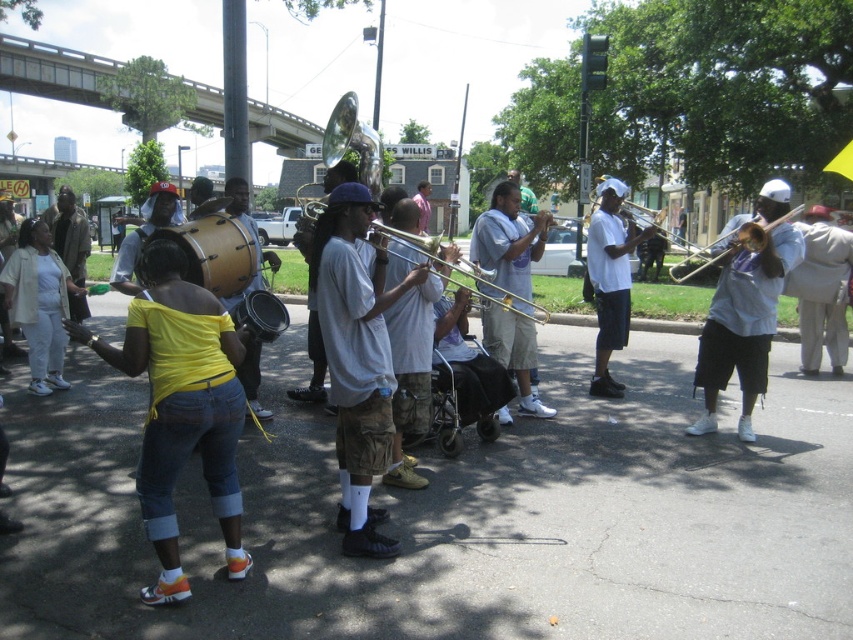
Is yellow fabric shirt at center further to camera compared to matte black jacket at left?

No, it is not.

Can you confirm if yellow fabric shirt at center is bigger than matte black jacket at left?

Actually, yellow fabric shirt at center might be smaller than matte black jacket at left.

Where is `yellow fabric shirt at center`? yellow fabric shirt at center is located at coordinates point(181,406).

Is white matte trombone at center further to the viewer compared to shiny gold trombone at center?

Yes, white matte trombone at center is further from the viewer.

Does white matte trombone at center appear over shiny gold trombone at center?

No, white matte trombone at center is not above shiny gold trombone at center.

I want to click on white matte trombone at center, so click(x=610, y=280).

The image size is (853, 640). In order to click on white matte trombone at center in this screenshot , I will do `click(610, 280)`.

In the scene shown: Can you confirm if white cotton pants at center is shorter than shiny gold trombone at center?

Indeed, white cotton pants at center has a lesser height compared to shiny gold trombone at center.

Where is `white cotton pants at center`? This screenshot has height=640, width=853. white cotton pants at center is located at coordinates click(x=39, y=304).

The height and width of the screenshot is (640, 853). In order to click on white cotton pants at center in this screenshot , I will do `click(39, 304)`.